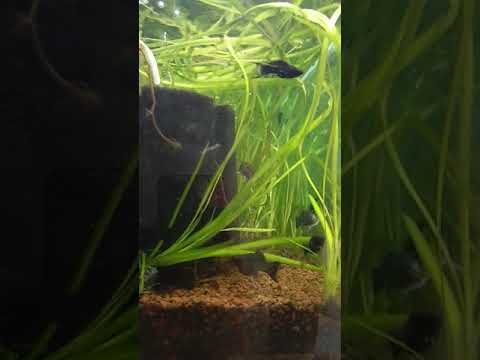
Locate an element on the screen. cord is located at coordinates (152, 70).